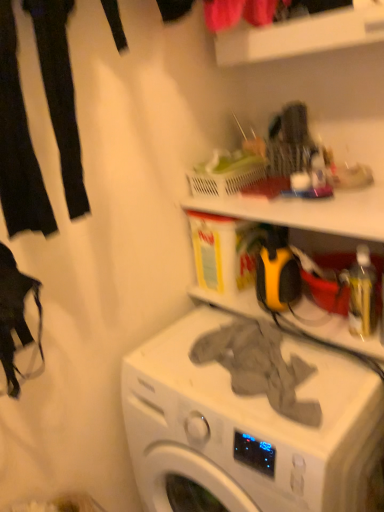
Question: Is the position of black fabric pants at left, which is counted as the 1th clothing, starting from the top, less distant than that of gray fabric at center, which is counted as the second clothing, starting from the left?

Choices:
 (A) yes
 (B) no

Answer: (A)

Question: Considering the relative sizes of black fabric pants at left, which is the 1th clothing in left-to-right order, and gray fabric at center, which appears as the second clothing when viewed from the top, in the image provided, is black fabric pants at left, which is the 1th clothing in left-to-right order, wider than gray fabric at center, which appears as the second clothing when viewed from the top,?

Choices:
 (A) no
 (B) yes

Answer: (A)

Question: Is black fabric pants at left, which is counted as the 1th clothing, starting from the top, at the right side of gray fabric at center, placed as the first clothing when sorted from bottom to top?

Choices:
 (A) yes
 (B) no

Answer: (B)

Question: Considering the relative sizes of black fabric pants at left, the second clothing from the right, and gray fabric at center, which appears as the second clothing when viewed from the top, in the image provided, is black fabric pants at left, the second clothing from the right, shorter than gray fabric at center, which appears as the second clothing when viewed from the top,?

Choices:
 (A) no
 (B) yes

Answer: (A)

Question: Is black fabric pants at left, which is counted as the 1th clothing, starting from the top, far away from gray fabric at center, placed as the first clothing when sorted from bottom to top?

Choices:
 (A) no
 (B) yes

Answer: (A)

Question: Considering the positions of gray fabric at center and translucent plastic basket at upper center in the image, is gray fabric at center wider or thinner than translucent plastic basket at upper center?

Choices:
 (A) thin
 (B) wide

Answer: (B)

Question: Based on their sizes in the image, would you say gray fabric at center is bigger or smaller than translucent plastic basket at upper center?

Choices:
 (A) big
 (B) small

Answer: (A)

Question: Based on their positions, is gray fabric at center located to the left or right of translucent plastic basket at upper center?

Choices:
 (A) right
 (B) left

Answer: (A)

Question: Is gray fabric at center taller or shorter than translucent plastic basket at upper center?

Choices:
 (A) tall
 (B) short

Answer: (A)

Question: Do you think gray fabric at center, which appears as the second clothing when viewed from the top, is within black fabric pants at left, which is counted as the 1th clothing, starting from the top, or outside of it?

Choices:
 (A) inside
 (B) outside

Answer: (B)

Question: Considering the positions of gray fabric at center, which is counted as the second clothing, starting from the left, and black fabric pants at left, which is counted as the 1th clothing, starting from the top, in the image, is gray fabric at center, which is counted as the second clothing, starting from the left, wider or thinner than black fabric pants at left, which is counted as the 1th clothing, starting from the top,?

Choices:
 (A) wide
 (B) thin

Answer: (A)

Question: Considering the positions of gray fabric at center, which appears as the second clothing when viewed from the top, and black fabric pants at left, which is counted as the 1th clothing, starting from the top, in the image, is gray fabric at center, which appears as the second clothing when viewed from the top, bigger or smaller than black fabric pants at left, which is counted as the 1th clothing, starting from the top,?

Choices:
 (A) small
 (B) big

Answer: (A)

Question: Relative to black fabric pants at left, the second clothing ordered from the bottom, is gray fabric at center, placed as the first clothing when sorted from bottom to top, in front or behind?

Choices:
 (A) behind
 (B) front

Answer: (A)

Question: Would you say gray fabric at center is to the left or to the right of gray fabric at center, acting as the 1th clothing starting from the right, in the picture?

Choices:
 (A) left
 (B) right

Answer: (B)

Question: Does point (307, 495) appear closer or farther from the camera than point (218, 343)?

Choices:
 (A) farther
 (B) closer

Answer: (B)